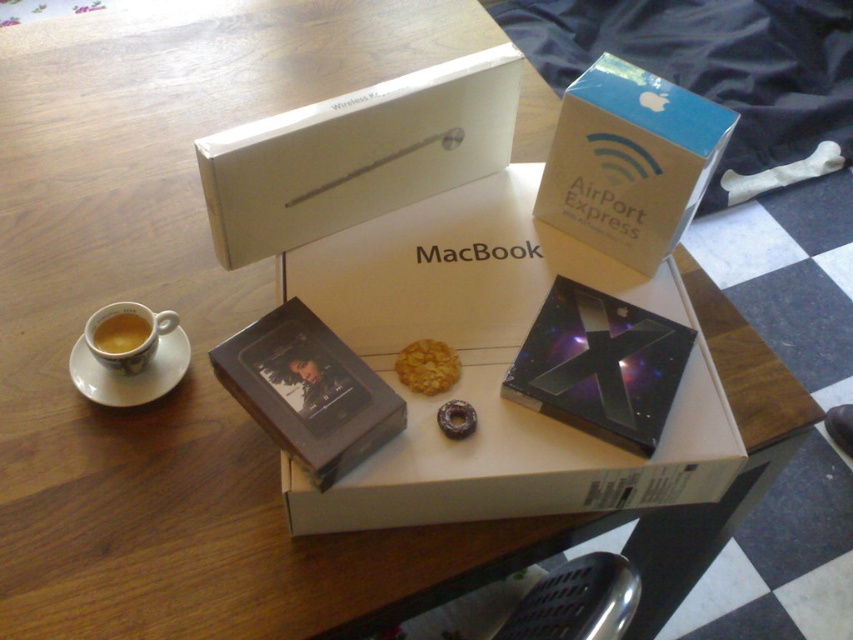
You are setting up a new MacBook and need to place both the white cardboard box at center and the matte ceramic cup at left on a shelf. The shelf has limited vertical space. Which item should you place first to ensure both fit vertically?

The matte ceramic cup at left is shorter, so place it first on the shelf to accommodate the taller white cardboard box at center above it.

You are looking at the wooden table with the MacBook box in the center. There are two points marked on the table. One is at coordinate point (488, 230) and the other is at point (606, 208). Which point is closer to you?

Point (488, 230) is further to the camera than point (606, 208), so the point closer to you is point (606, 208).